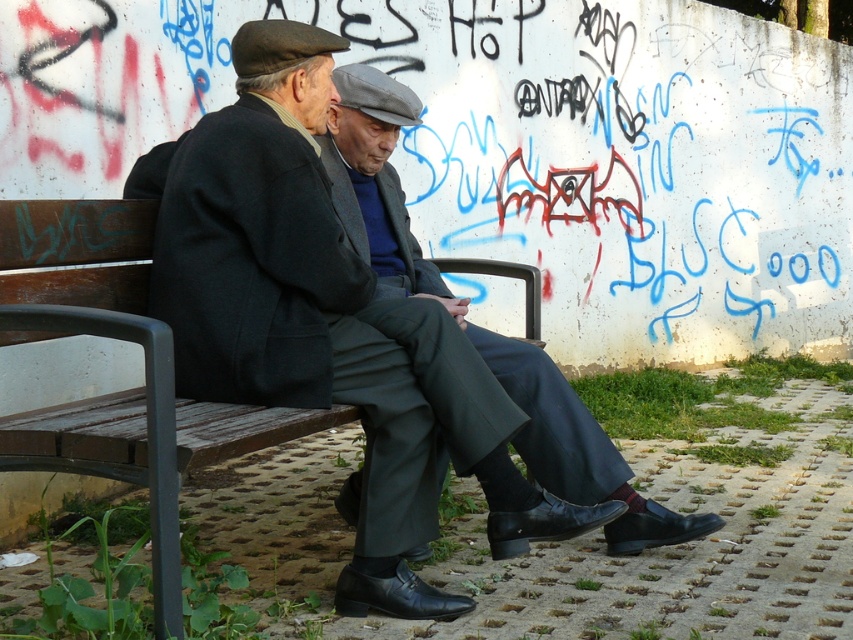
Question: Is matte black suit at center to the left of dark gray wool suit at center from the viewer's perspective?

Choices:
 (A) yes
 (B) no

Answer: (A)

Question: Which of the following is the closest to the observer?

Choices:
 (A) (357, 355)
 (B) (80, 260)

Answer: (A)

Question: Observing the image, what is the correct spatial positioning of matte black suit at center in reference to wooden bench at center?

Choices:
 (A) above
 (B) below

Answer: (A)

Question: Estimate the real-world distances between objects in this image. Which object is farther from the matte black suit at center?

Choices:
 (A) wooden bench at center
 (B) dark gray wool suit at center

Answer: (B)

Question: Which of the following is the closest to the observer?

Choices:
 (A) dark gray wool suit at center
 (B) wooden bench at center

Answer: (B)

Question: Is matte black suit at center positioned in front of dark gray wool suit at center?

Choices:
 (A) yes
 (B) no

Answer: (A)